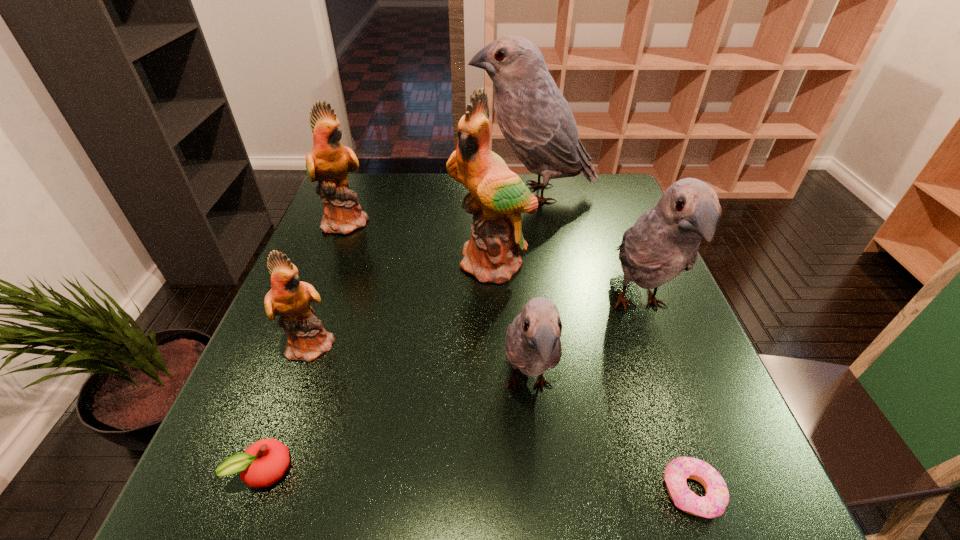
Identify the location of free space at the left edge of the desktop. [x=244, y=385].

What are the coordinates of `vacant space at the right edge of the desktop` in the screenshot? It's located at (629, 338).

Find the location of a particular element. free space at the far left corner of the desktop is located at coordinates (357, 186).

The width and height of the screenshot is (960, 540). Identify the location of blank space at the far right corner. (627, 204).

Locate an element on the screen. The width and height of the screenshot is (960, 540). free space between the smallest gray parrot and the second smallest gray parrot is located at coordinates (584, 346).

Where is `free space that is in between the second biggest green parrot and the nearest green parrot`? The image size is (960, 540). free space that is in between the second biggest green parrot and the nearest green parrot is located at coordinates (330, 282).

The width and height of the screenshot is (960, 540). In order to click on vacant space that's between the second shortest object and the farthest gray parrot in this screenshot , I will do (399, 332).

I want to click on free space between the farthest green parrot and the biggest gray parrot, so (x=440, y=207).

The image size is (960, 540). I want to click on vacant space that's between the farthest gray parrot and the apple, so click(399, 332).

This screenshot has width=960, height=540. I want to click on empty location between the nearest green parrot and the biggest gray parrot, so click(422, 268).